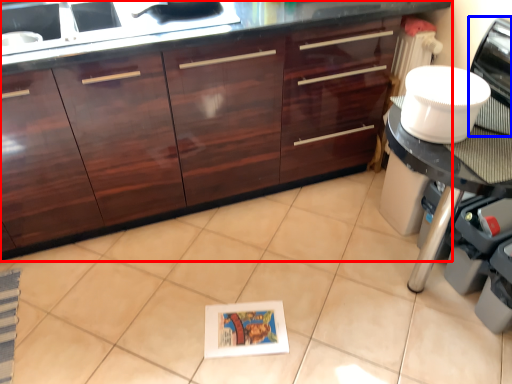
Question: Which object is further to the camera taking this photo, cabinetry (highlighted by a red box) or home appliance (highlighted by a blue box)?

Choices:
 (A) cabinetry
 (B) home appliance

Answer: (A)